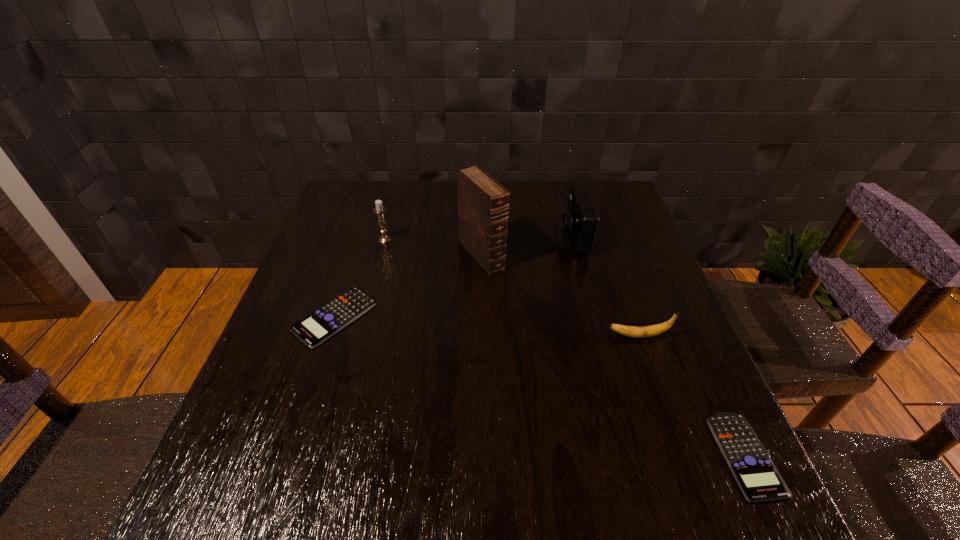
Find the location of `free point between the candle holder and the fourth tallest object`. free point between the candle holder and the fourth tallest object is located at coordinates (512, 288).

This screenshot has width=960, height=540. In order to click on vacant area between the right calculator and the tallest object in this screenshot , I will do `click(613, 355)`.

You are a GUI agent. You are given a task and a screenshot of the screen. Output one action in this format:
    pyautogui.click(x=<x>, y=<y>)
    Task: Click on the vacant space in between the tallest object and the taller calculator
    The image size is (960, 540).
    Given the screenshot: What is the action you would take?
    pyautogui.click(x=408, y=286)

Locate an element on the screen. object that stands as the fourth closest to the candle holder is located at coordinates (653, 330).

The height and width of the screenshot is (540, 960). Find the location of `object identified as the third closest to the Bible`. object identified as the third closest to the Bible is located at coordinates (314, 329).

This screenshot has width=960, height=540. What are the coordinates of `free space in the image that satisfies the following two spatial constraints: 1. on the front-facing side of the camera; 2. on the left side of the right calculator` in the screenshot? It's located at (630, 455).

This screenshot has height=540, width=960. Identify the location of free space that satisfies the following two spatial constraints: 1. on the front-facing side of the camera; 2. on the front side of the candle holder. (574, 240).

This screenshot has width=960, height=540. I want to click on free space that satisfies the following two spatial constraints: 1. on the back side of the right calculator; 2. on the front-facing side of the camera, so click(644, 237).